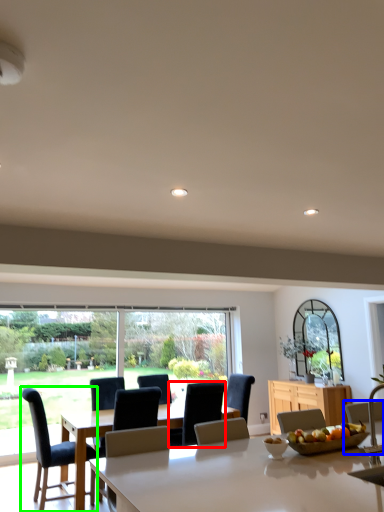
Question: Considering the real-world distances, which object is farthest from chair (highlighted by a red box)? chair (highlighted by a blue box) or chair (highlighted by a green box)?

Choices:
 (A) chair
 (B) chair

Answer: (A)